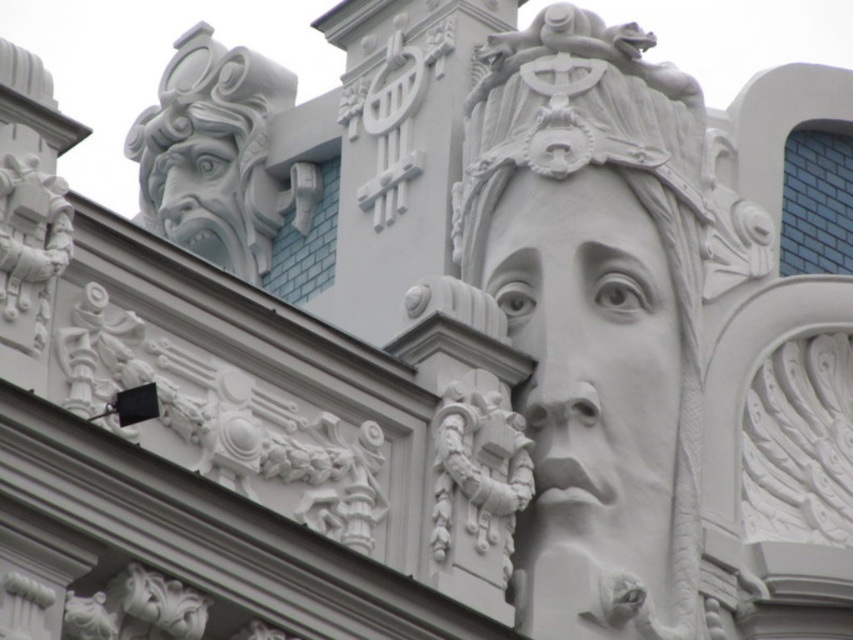
Based on the photo, is white stone sculpture at upper center to the left of white stone face at center from the viewer's perspective?

In fact, white stone sculpture at upper center is to the right of white stone face at center.

Locate an element on the screen. white stone sculpture at upper center is located at coordinates (601, 310).

Is white stone sculpture at upper center taller than white stone gargoyle at upper left?

Yes.

Does point (560, 448) come farther from viewer compared to point (212, 60)?

That is False.

The height and width of the screenshot is (640, 853). What do you see at coordinates (601, 310) in the screenshot?
I see `white stone sculpture at upper center` at bounding box center [601, 310].

Locate an element on the screen. The width and height of the screenshot is (853, 640). white stone sculpture at upper center is located at coordinates (601, 310).

Between white stone face at center and white stone gargoyle at upper left, which one is positioned lower?

white stone face at center is lower down.

Between point (650, 417) and point (265, 68), which one is positioned in front?

Positioned in front is point (650, 417).

This screenshot has width=853, height=640. In order to click on white stone face at center in this screenshot , I will do coord(590,346).